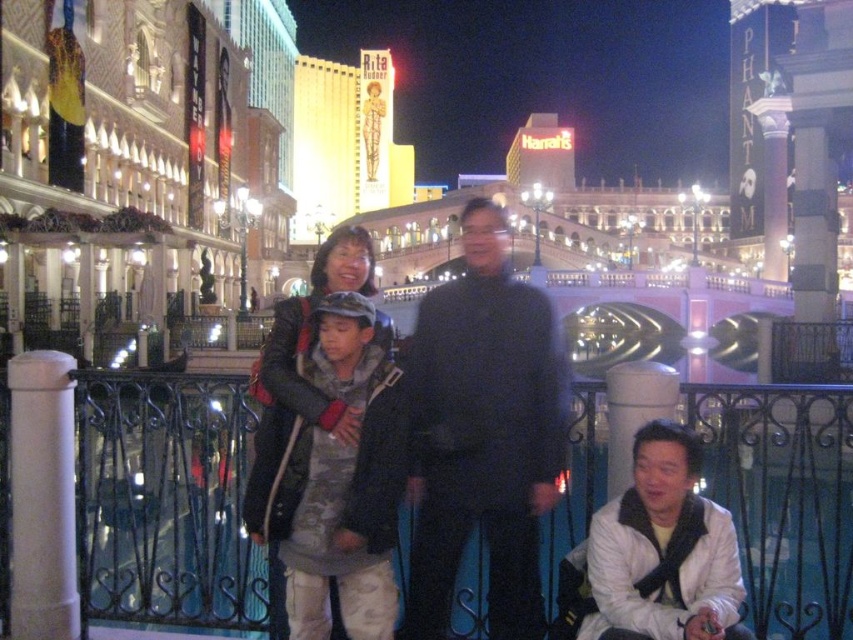
Which is behind, point (442, 584) or point (587, 637)?

Positioned behind is point (442, 584).

Is point (473, 236) behind point (683, 588)?

Yes, it is.

Find the location of `black matte coat at center`. black matte coat at center is located at coordinates (482, 433).

Can you confirm if white matte jacket at lower right is positioned to the right of leather jacket at center?

Indeed, white matte jacket at lower right is positioned on the right side of leather jacket at center.

Can you confirm if white matte jacket at lower right is positioned to the left of leather jacket at center?

In fact, white matte jacket at lower right is to the right of leather jacket at center.

Is point (642, 608) more distant than point (288, 348)?

No.

Where is `white matte jacket at lower right`? The image size is (853, 640). white matte jacket at lower right is located at coordinates (663, 550).

Looking at this image, can you confirm if black matte coat at center is thinner than leather jacket at center?

Yes.

Between point (451, 577) and point (329, 595), which one is positioned behind?

Point (451, 577)

The image size is (853, 640). Identify the location of black matte coat at center. (482, 433).